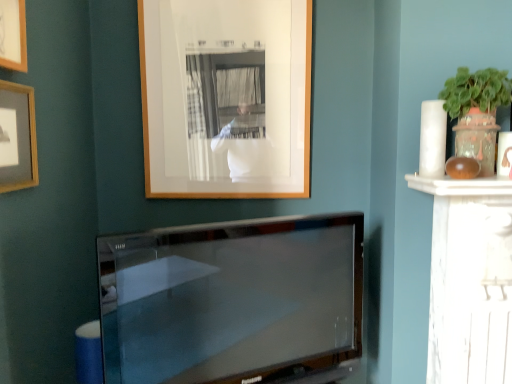
Question: From the image's perspective, is wooden picture frame at upper center, positioned as the third picture frame in front-to-back order, beneath satin black tv at center?

Choices:
 (A) no
 (B) yes

Answer: (A)

Question: Is wooden picture frame at upper center, positioned as the third picture frame in front-to-back order, positioned before satin black tv at center?

Choices:
 (A) yes
 (B) no

Answer: (B)

Question: Is wooden picture frame at upper center, arranged as the first picture frame when viewed from the right, positioned beyond the bounds of satin black tv at center?

Choices:
 (A) no
 (B) yes

Answer: (B)

Question: Considering the relative sizes of wooden picture frame at upper center, which is the first picture frame in back-to-front order, and satin black tv at center in the image provided, is wooden picture frame at upper center, which is the first picture frame in back-to-front order, taller than satin black tv at center?

Choices:
 (A) yes
 (B) no

Answer: (A)

Question: Is wooden picture frame at upper center, which appears as the 3th picture frame when viewed from the left, looking in the opposite direction of satin black tv at center?

Choices:
 (A) yes
 (B) no

Answer: (B)

Question: Considering the positions of satin black tv at center and wooden picture frame at upper center, positioned as the third picture frame in front-to-back order, in the image, is satin black tv at center bigger or smaller than wooden picture frame at upper center, positioned as the third picture frame in front-to-back order,?

Choices:
 (A) big
 (B) small

Answer: (A)

Question: Is satin black tv at center inside or outside of wooden picture frame at upper center, positioned as the third picture frame in front-to-back order?

Choices:
 (A) inside
 (B) outside

Answer: (B)

Question: In terms of width, does satin black tv at center look wider or thinner when compared to wooden picture frame at upper center, which is the first picture frame in back-to-front order?

Choices:
 (A) wide
 (B) thin

Answer: (A)

Question: From a real-world perspective, is satin black tv at center physically located above or below wooden picture frame at upper center, which is the first picture frame in back-to-front order?

Choices:
 (A) below
 (B) above

Answer: (A)

Question: Relative to satin black tv at center, is wooden picture frame at upper center, arranged as the first picture frame when viewed from the right, in front or behind?

Choices:
 (A) behind
 (B) front

Answer: (A)

Question: Does point (237, 193) appear closer or farther from the camera than point (358, 317)?

Choices:
 (A) farther
 (B) closer

Answer: (A)

Question: From the image's perspective, is wooden picture frame at upper center, arranged as the first picture frame when viewed from the right, above or below satin black tv at center?

Choices:
 (A) above
 (B) below

Answer: (A)

Question: In the image, is wooden picture frame at upper center, which is the first picture frame in back-to-front order, on the left side or the right side of satin black tv at center?

Choices:
 (A) right
 (B) left

Answer: (B)

Question: From a real-world perspective, is matte wooden picture frame at upper left, which is the third picture frame in right-to-left order, above or below wooden picture frame at upper left, the first picture frame in the front-to-back sequence?

Choices:
 (A) above
 (B) below

Answer: (B)

Question: Would you say matte wooden picture frame at upper left, which ranks as the second picture frame in back-to-front order, is inside or outside wooden picture frame at upper left, which appears as the second picture frame when viewed from the left?

Choices:
 (A) inside
 (B) outside

Answer: (B)